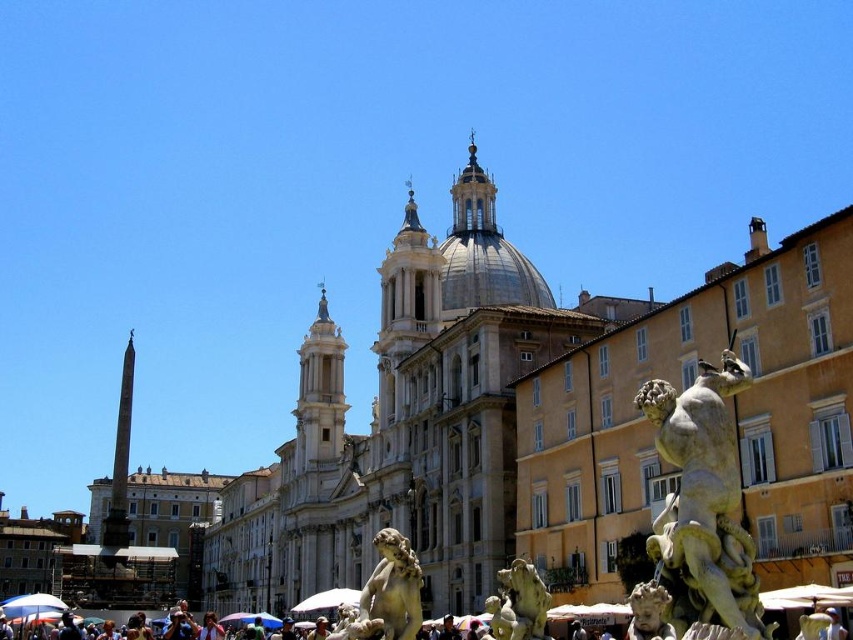
You are a tourist standing in front of the Fountain of Four Rivers at Piazza Navona. You notice a white marble statue at center and a white marble cherub at lower right. Which object is closer to you?

The white marble statue at center is closer to you because it is further to the viewer than the white marble cherub at lower right.

You are an art student visiting Piazza Navona and want to sketch the statues at the Fountain of Four Rivers. You notice two statues at the lower right of the fountain. Which statue has a wider base? The white marble statue at lower right or the green marble statue at lower right?

The white marble statue at lower right has a wider base than the green marble statue at lower right.